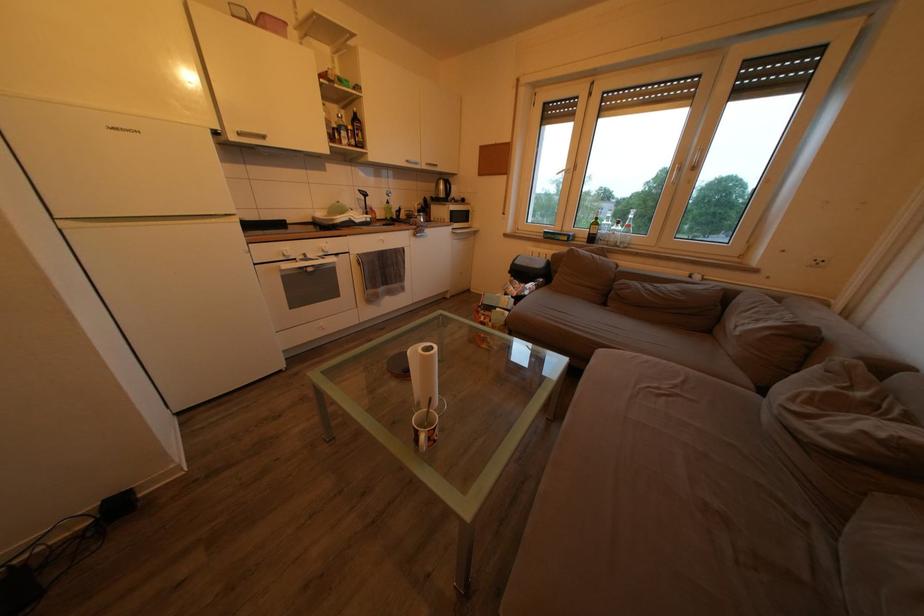
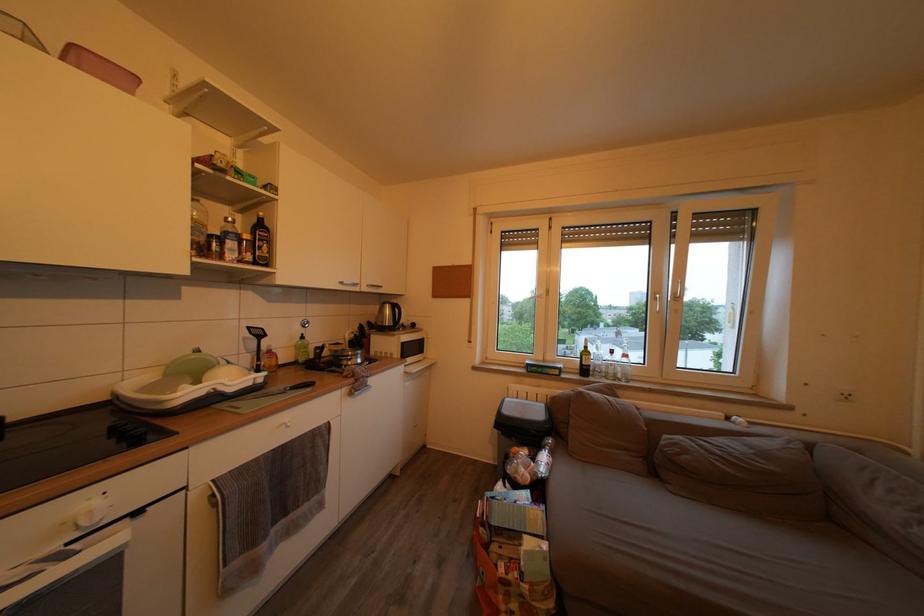
Where in the second image is the point corresponding to (358,132) from the first image?

(253, 243)